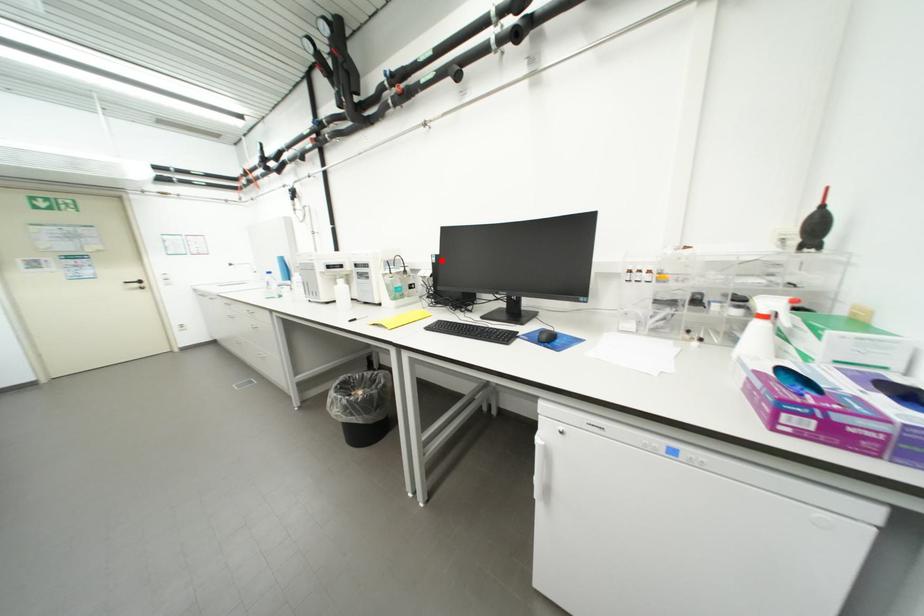
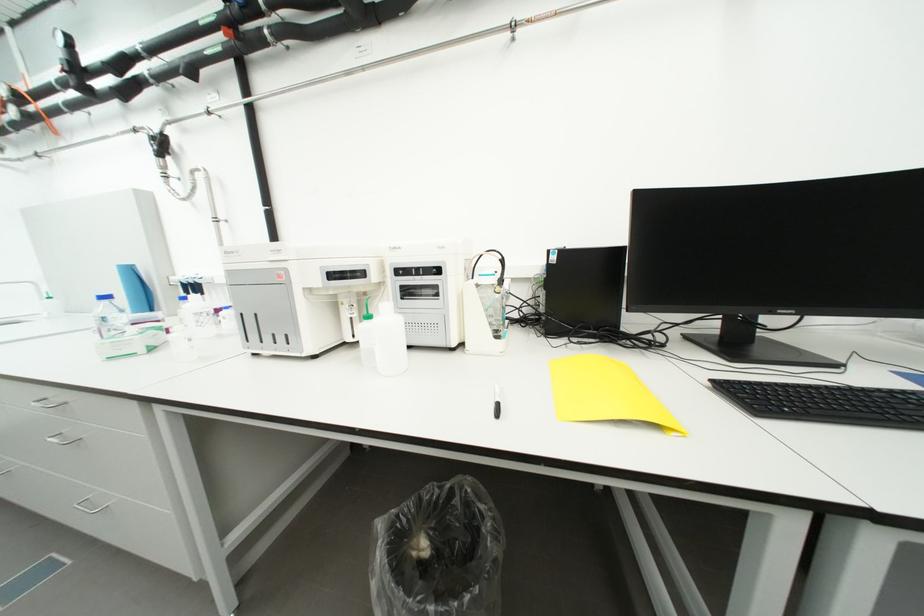
Question: I am providing you with two images of the same scene from different viewpoints. A red point is marked on the first image. At the location where the point appears in image 1, is it still visible in image 2?

Choices:
 (A) Yes
 (B) No

Answer: (A)